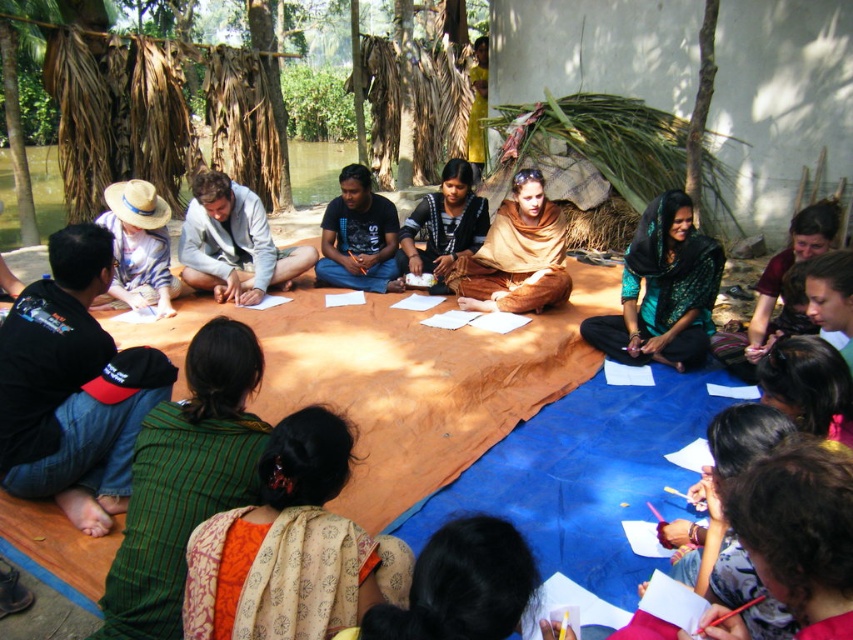
Does point (502, 227) lie behind point (436, 262)?

No.

Who is more distant from viewer, (529, 204) or (405, 250)?

Positioned behind is point (405, 250).

Between point (570, 284) and point (424, 246), which one is positioned behind?

The point (424, 246) is behind.

Identify the location of brown textured shawl at center. (515, 256).

Is green plaid shirt at lower left above black cotton shirt at center?

No, green plaid shirt at lower left is not above black cotton shirt at center.

This screenshot has height=640, width=853. What do you see at coordinates (184, 480) in the screenshot? I see `green plaid shirt at lower left` at bounding box center [184, 480].

At what (x,y) coordinates should I click in order to perform the action: click on green plaid shirt at lower left. Please return your answer as a coordinate pair (x, y). Looking at the image, I should click on (184, 480).

Is black cotton shirt at center to the right of brown woven cloth at center from the viewer's perspective?

Incorrect, black cotton shirt at center is not on the right side of brown woven cloth at center.

Is black cotton shirt at center further to camera compared to brown woven cloth at center?

That is True.

This screenshot has height=640, width=853. I want to click on black cotton shirt at center, so click(x=358, y=236).